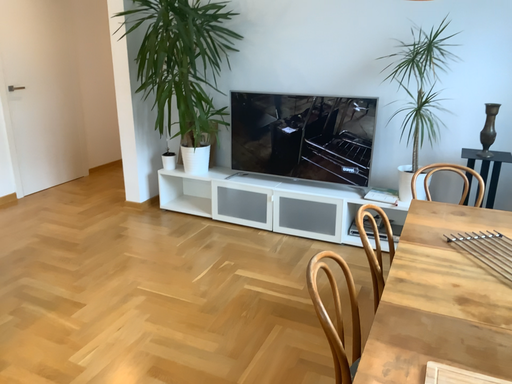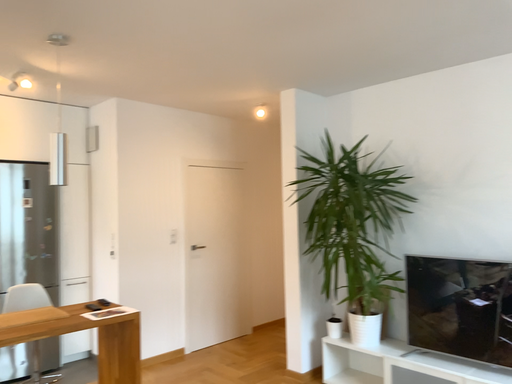
Question: How did the camera likely rotate when shooting the video?

Choices:
 (A) rotated downward
 (B) rotated upward

Answer: (B)